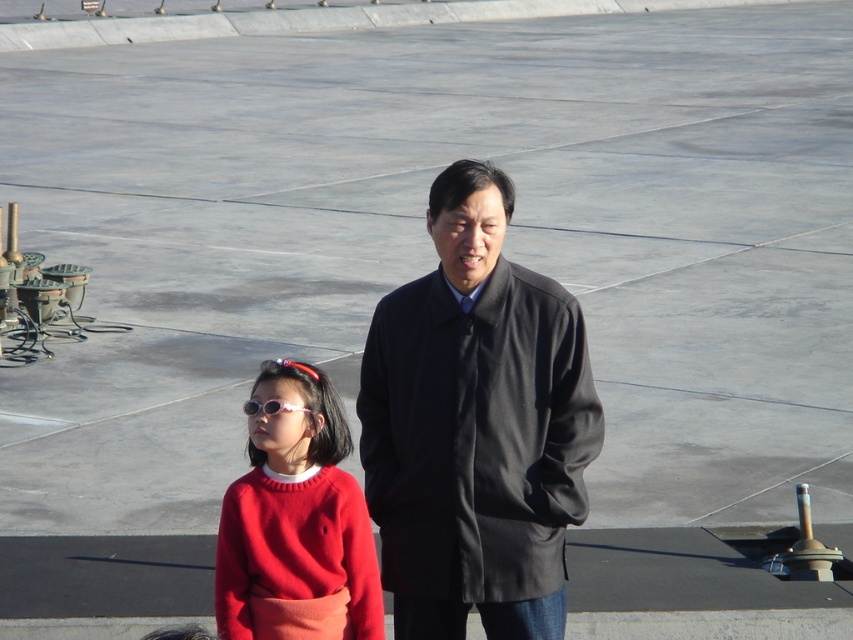
Does dark gray woolen coat at center have a greater height compared to matte red sweater at center?

Correct, dark gray woolen coat at center is much taller as matte red sweater at center.

Which is below, dark gray woolen coat at center or matte red sweater at center?

matte red sweater at center is lower down.

Between point (456, 324) and point (260, 499), which one is positioned behind?

Point (456, 324)

Locate an element on the screen. The image size is (853, 640). dark gray woolen coat at center is located at coordinates (476, 426).

Consider the image. Who is taller, matte red sweater at center or pink shiny sunglasses at center?

With more height is matte red sweater at center.

Is point (326, 512) positioned behind point (277, 403)?

Yes, point (326, 512) is behind point (277, 403).

At what (x,y) coordinates should I click in order to perform the action: click on matte red sweater at center. Please return your answer as a coordinate pair (x, y). This screenshot has height=640, width=853. Looking at the image, I should click on (296, 524).

Locate an element on the screen. The height and width of the screenshot is (640, 853). dark gray woolen coat at center is located at coordinates (476, 426).

Who is positioned more to the right, dark gray woolen coat at center or pink shiny sunglasses at center?

From the viewer's perspective, dark gray woolen coat at center appears more on the right side.

The height and width of the screenshot is (640, 853). I want to click on dark gray woolen coat at center, so (x=476, y=426).

Where is `dark gray woolen coat at center`? dark gray woolen coat at center is located at coordinates (476, 426).